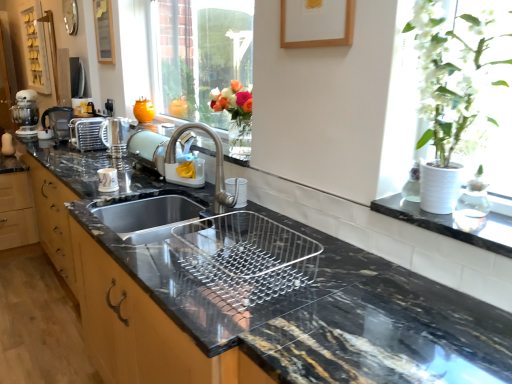
Locate an element on the screen. The width and height of the screenshot is (512, 384). free location in front of satin nickel faucet at center is located at coordinates (182, 236).